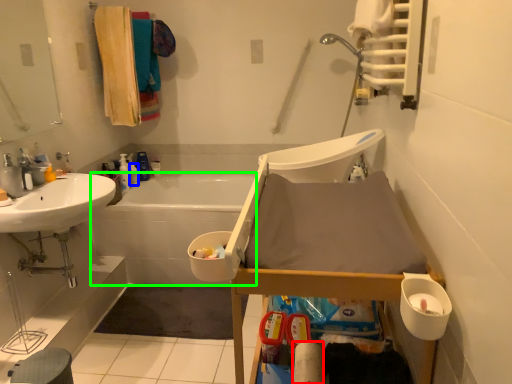
Question: Estimate the real-world distances between objects in this image. Which object is closer to toilet paper (highlighted by a red box), toiletry (highlighted by a blue box) or bath (highlighted by a green box)?

Choices:
 (A) toiletry
 (B) bath

Answer: (B)